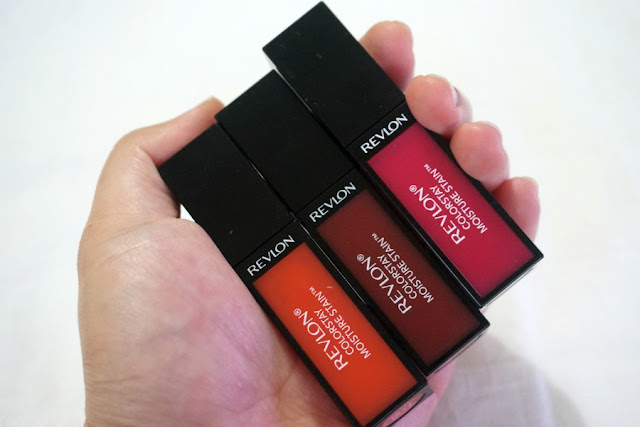
Find the location of a particular element. wall is located at coordinates (59, 245).